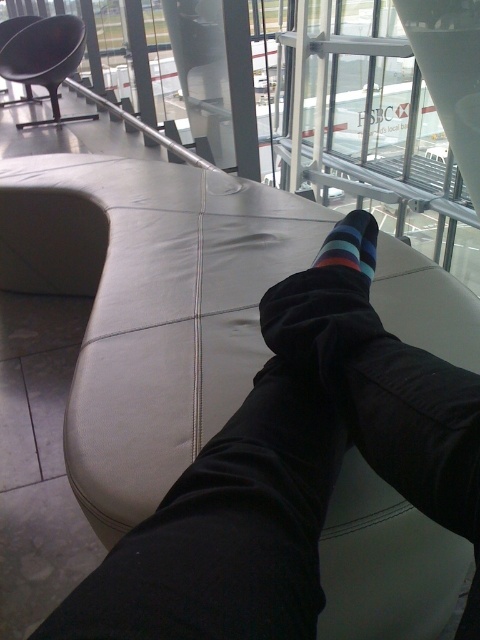
Which is behind, point (73, 54) or point (365, 250)?

Point (73, 54)

Does matte black chair at upper left appear on the left side of striped cotton sock at center?

Correct, you'll find matte black chair at upper left to the left of striped cotton sock at center.

The image size is (480, 640). What do you see at coordinates (46, 60) in the screenshot?
I see `matte black chair at upper left` at bounding box center [46, 60].

Identify the location of matte black chair at upper left. Image resolution: width=480 pixels, height=640 pixels. tap(46, 60).

Who is taller, matte black pants at center or matte black chair at upper left?

Standing taller between the two is matte black chair at upper left.

Locate an element on the screen. The width and height of the screenshot is (480, 640). matte black pants at center is located at coordinates (290, 477).

This screenshot has height=640, width=480. I want to click on matte black pants at center, so click(290, 477).

Between matte black pants at center and striped cotton sock at center, which one is positioned higher?

striped cotton sock at center

Is point (248, 588) positioned before point (328, 253)?

That is True.

I want to click on matte black pants at center, so click(x=290, y=477).